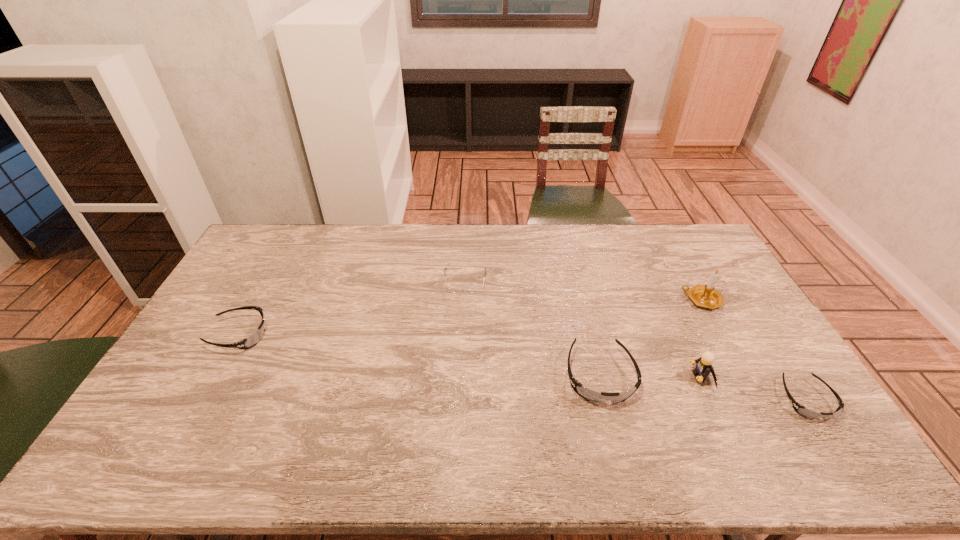
Identify the location of the leftmost object. This screenshot has width=960, height=540. (252, 340).

Find the location of a particular element. the second shortest sunglasses is located at coordinates (252, 340).

Find the location of a particular element. Image resolution: width=960 pixels, height=540 pixels. the second sunglasses from left to right is located at coordinates (588, 394).

At what (x,y) coordinates should I click in order to perform the action: click on the fourth object from right to left. Please return your answer as a coordinate pair (x, y). Looking at the image, I should click on (588, 394).

The width and height of the screenshot is (960, 540). In order to click on the rightmost sunglasses in this screenshot , I will do `click(801, 410)`.

Where is `the shortest sunglasses`? This screenshot has height=540, width=960. the shortest sunglasses is located at coordinates (801, 410).

Identify the location of the second object from right to left. The image size is (960, 540). (706, 296).

Where is `the tallest object`? Image resolution: width=960 pixels, height=540 pixels. the tallest object is located at coordinates (706, 296).

Locate an element on the screen. the fifth shortest object is located at coordinates (703, 368).

Where is `Lego`? This screenshot has height=540, width=960. Lego is located at coordinates click(703, 368).